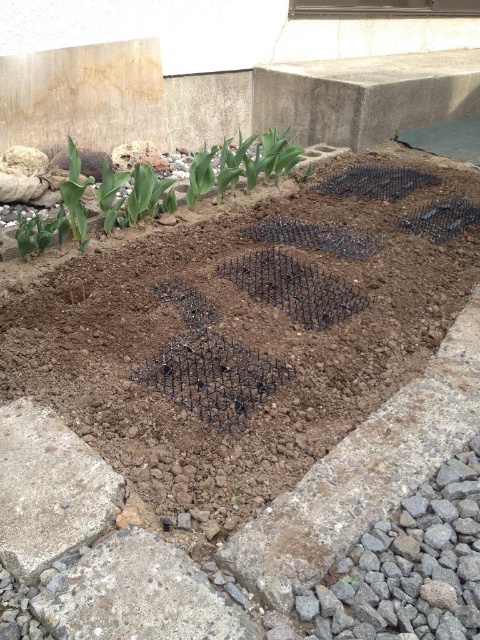
Is green leafy plant at upper left shorter than green leafy plant at left?

In fact, green leafy plant at upper left may be taller than green leafy plant at left.

You are a GUI agent. You are given a task and a screenshot of the screen. Output one action in this format:
    pyautogui.click(x=<x>, y=<y>)
    Task: Click on the green leafy plant at upper left
    Image resolution: width=480 pixels, height=640 pixels.
    Given the screenshot: What is the action you would take?
    pyautogui.click(x=97, y=205)

Is point (62, 195) behind point (71, 221)?

No, (62, 195) is closer to viewer.

Identify the location of green leafy plant at upper left. (97, 205).